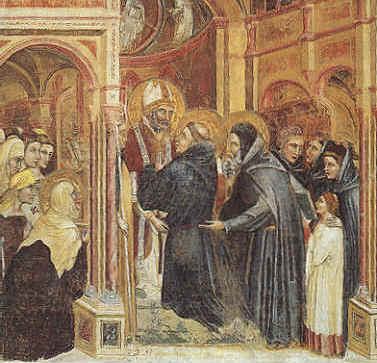
Identify the location of robe. coord(33,303), coord(178,276), coord(274,262), coord(321,280), coord(350,220).